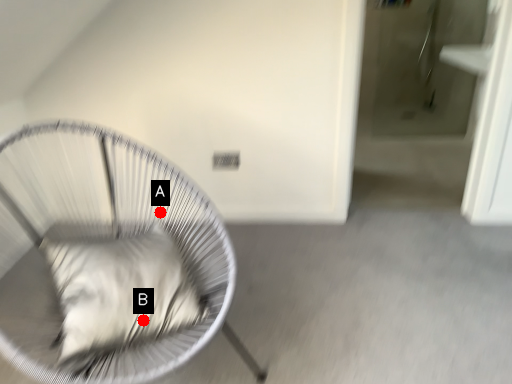
Question: Two points are circled on the image, labeled by A and B beside each circle. Which point is closer to the camera?

Choices:
 (A) A is closer
 (B) B is closer

Answer: (B)